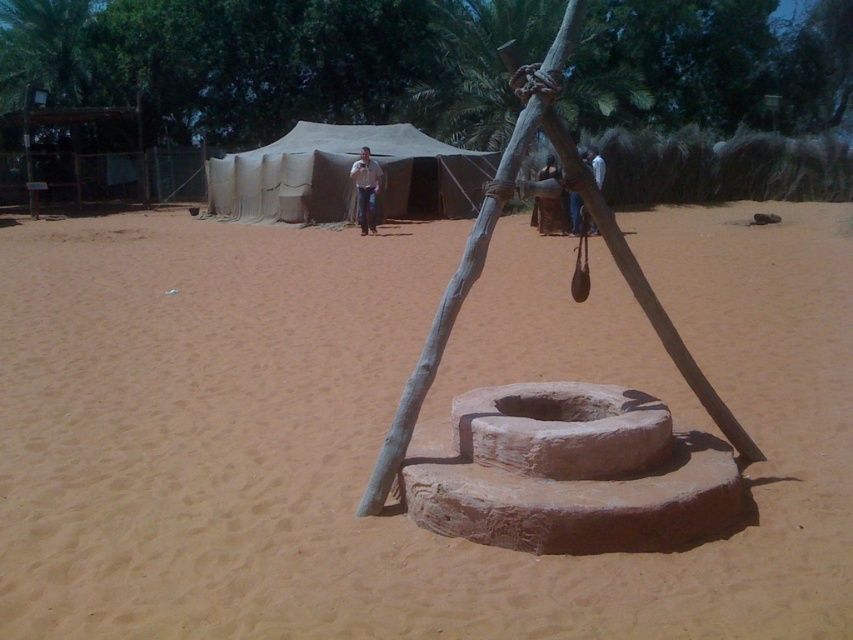
Between brown sandy dirt at center and beige canvas tent at center, which one has more height?

beige canvas tent at center

Which is below, brown sandy dirt at center or beige canvas tent at center?

brown sandy dirt at center is lower down.

Does point (801, 305) lie behind point (294, 131)?

No, it is in front of (294, 131).

Locate an element on the screen. The width and height of the screenshot is (853, 640). brown sandy dirt at center is located at coordinates (378, 435).

Is point (431, 388) closer to viewer compared to point (366, 192)?

Yes, it is.

Can you confirm if brown sandy dirt at center is bigger than white shirt at center?

Yes, brown sandy dirt at center is bigger than white shirt at center.

This screenshot has width=853, height=640. I want to click on brown sandy dirt at center, so click(378, 435).

Locate an element on the screen. gray wood pole at center is located at coordinates (428, 358).

Is point (409, 412) positioned before point (548, 234)?

Yes, point (409, 412) is closer to viewer.

Locate an element on the screen. This screenshot has width=853, height=640. gray wood pole at center is located at coordinates (428, 358).